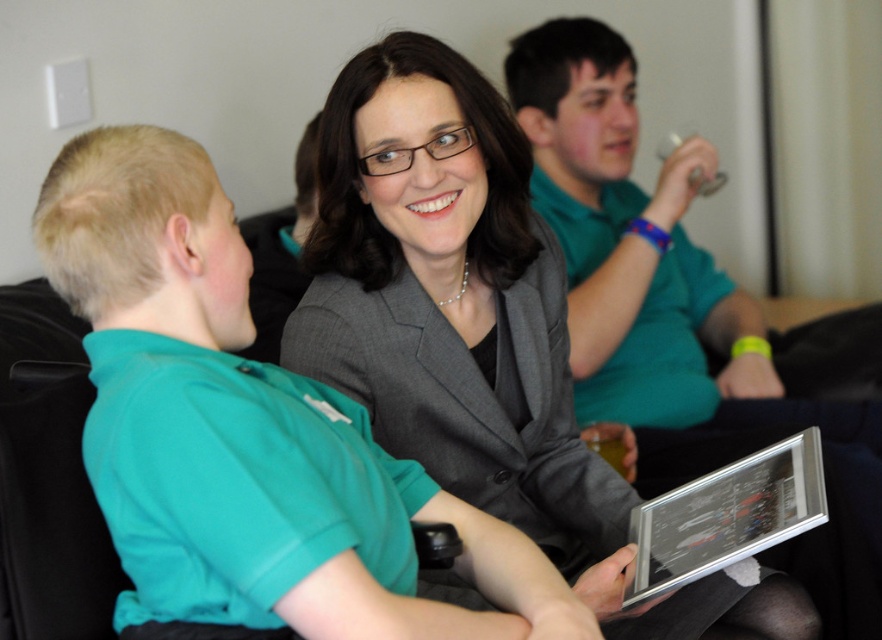
Which is more to the right, teal fabric shirt at left or matte gray blazer at center?

matte gray blazer at center is more to the right.

Between teal fabric shirt at left and matte gray blazer at center, which one appears on the left side from the viewer's perspective?

teal fabric shirt at left

This screenshot has height=640, width=882. Describe the element at coordinates (247, 429) in the screenshot. I see `teal fabric shirt at left` at that location.

This screenshot has width=882, height=640. I want to click on teal fabric shirt at left, so click(x=247, y=429).

Can you confirm if teal fabric shirt at left is positioned to the right of silver metallic tablet at center?

Incorrect, teal fabric shirt at left is not on the right side of silver metallic tablet at center.

Identify the location of teal fabric shirt at left. This screenshot has height=640, width=882. 247,429.

Is the position of matte gray blazer at center less distant than that of silver metallic tablet at center?

No, it is not.

Does matte gray blazer at center have a smaller size compared to silver metallic tablet at center?

No.

Does point (375, 102) come behind point (755, 545)?

Yes, point (375, 102) is farther from viewer.

Identify the location of matte gray blazer at center. (477, 332).